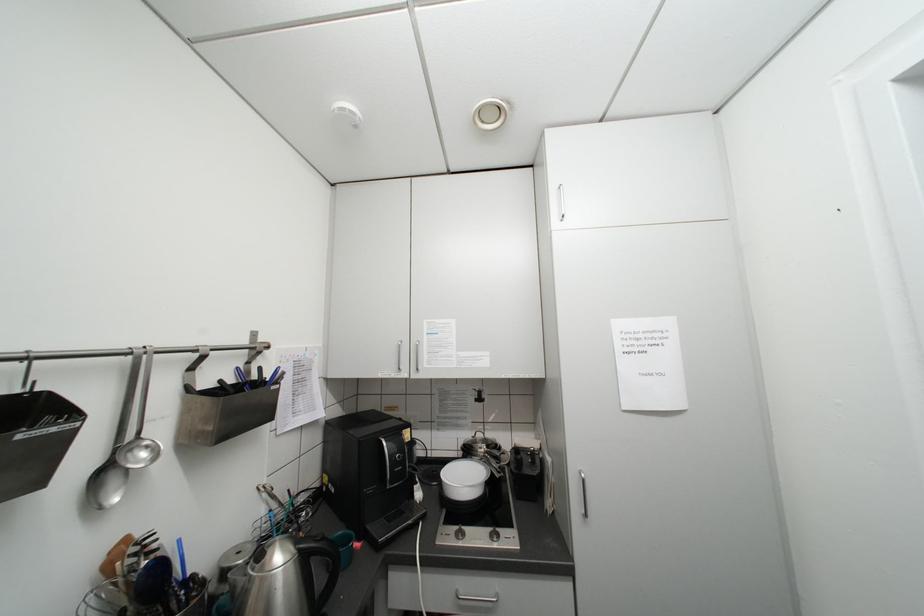
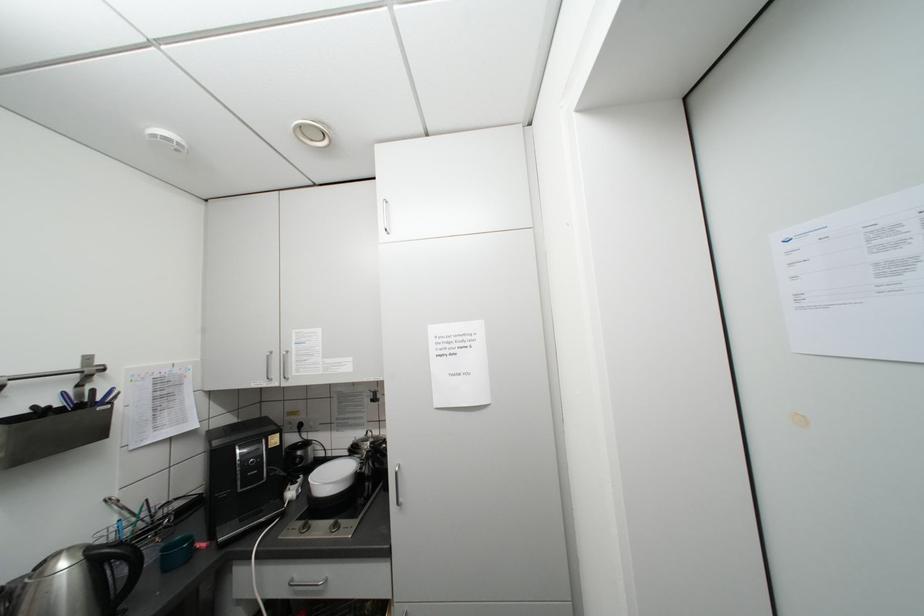
Question: Based on the continuous images, in which direction is the camera rotating? Reply with the corresponding letter.

Choices:
 (A) Left
 (B) Right
 (C) Up
 (D) Down

Answer: (D)